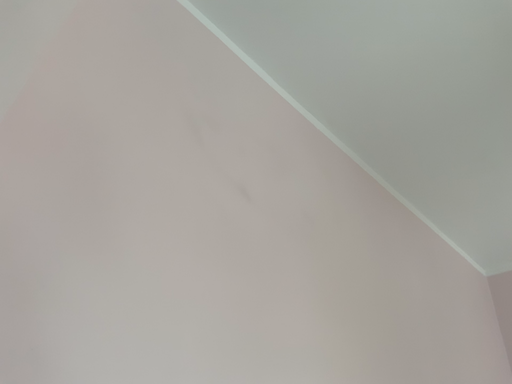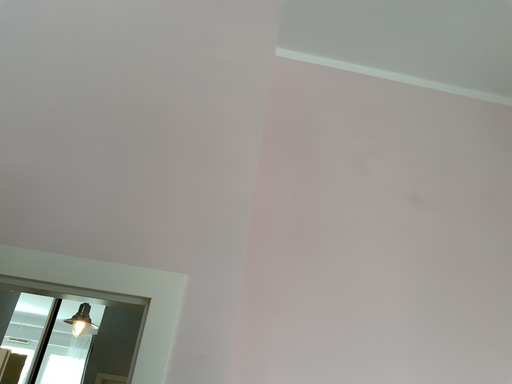
Question: Which way did the camera rotate in the video?

Choices:
 (A) rotated right
 (B) rotated left

Answer: (B)